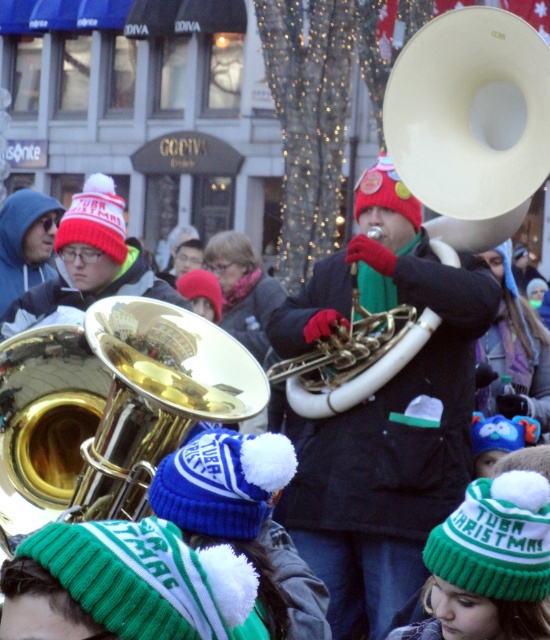
You are a photographer trying to capture a clear shot of both the gold brass tuba at center and the white glossy trumpet at center. Since you want to ensure both instruments are fully visible in the frame, which one should you focus on first to account for their sizes?

The gold brass tuba at center is taller than the white glossy trumpet at center, so you should focus on the gold brass tuba at center first to ensure it fits properly in the frame before adjusting for the smaller trumpet.

You are standing at the point marked as point [383,412] in the image. What is the nearest object to you?

The nearest object to you at point [383,412] is the gold brass tuba at center.

You are a photographer standing at the camera position. You want to capture a closeup shot of the gold brass tuba at center. Given that your telephoto lens can zoom up to 200mm, will you be able to get a clear closeup without moving closer?

The gold brass tuba at center is 132.74 feet away from the camera. With a telephoto lens of 200mm, it is possible to capture a closeup shot without moving closer, as modern telephoto lenses can effectively magnify subjects at such distances.